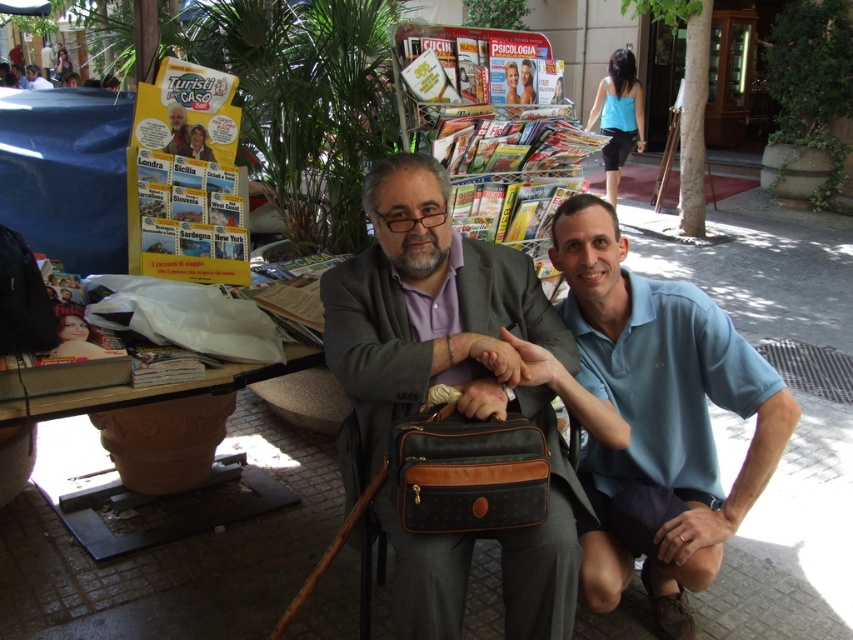
Does matte black bag at center appear on the left side of light blue cotton polo shirt at lower right?

Correct, you'll find matte black bag at center to the left of light blue cotton polo shirt at lower right.

Can you confirm if matte black bag at center is positioned to the right of light blue cotton polo shirt at lower right?

Incorrect, matte black bag at center is not on the right side of light blue cotton polo shirt at lower right.

Who is more forward, (421, 276) or (740, 355)?

Positioned in front is point (421, 276).

Locate an element on the screen. The width and height of the screenshot is (853, 640). matte black bag at center is located at coordinates (454, 387).

Which is more to the left, light blue cotton polo shirt at lower right or brown textured briefcase at center?

brown textured briefcase at center

Is light blue cotton polo shirt at lower right closer to camera compared to brown textured briefcase at center?

No, it is not.

Is point (633, 544) less distant than point (514, 451)?

That is False.

The image size is (853, 640). I want to click on light blue cotton polo shirt at lower right, so click(x=654, y=417).

Which is in front, point (569, 602) or point (163, 150)?

Point (569, 602)

Between point (381, 452) and point (173, 113), which one is positioned behind?

Positioned behind is point (173, 113).

At what (x,y) coordinates should I click in order to perform the action: click on matte black bag at center. Please return your answer as a coordinate pair (x, y). The height and width of the screenshot is (640, 853). Looking at the image, I should click on (454, 387).